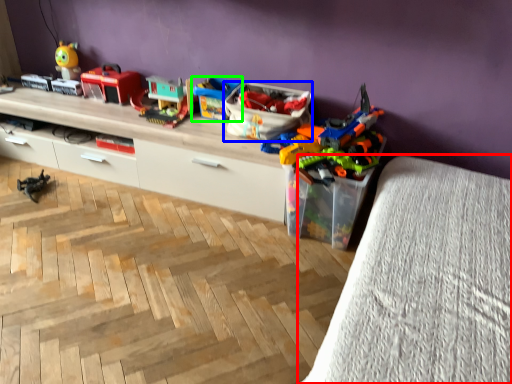
Question: Which is nearer to the furniture (highlighted by a red box)? storage box (highlighted by a blue box) or toy (highlighted by a green box).

Choices:
 (A) storage box
 (B) toy

Answer: (A)